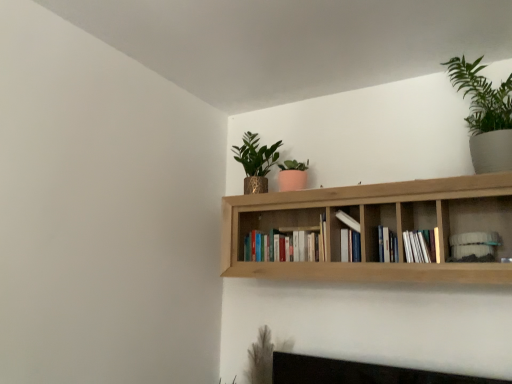
Question: Based on their positions, is natural wood bookshelf at upper center located to the left or right of hardcover books at center, which appears as the fifth book when viewed from the right?

Choices:
 (A) left
 (B) right

Answer: (B)

Question: From a real-world perspective, is natural wood bookshelf at upper center above or below hardcover books at center, which appears as the fifth book when viewed from the right?

Choices:
 (A) below
 (B) above

Answer: (B)

Question: Which is nearer to the white paper book at center-right, arranged as the 4th book when viewed from the left?

Choices:
 (A) white paper book at center, the second book when ordered from left to right
 (B) white matte bookshelf at upper right, the 5th book in the left-to-right sequence
 (C) matte gold pot at upper center, placed as the second houseplant when sorted from right to left
 (D) natural wood bookshelf at upper center
 (E) green matte plant at upper right, which appears as the first houseplant when viewed from the front

Answer: (B)

Question: Which object is the closest to the matte gold pot at upper center, placed as the second houseplant when sorted from right to left?

Choices:
 (A) natural wood bookshelf at upper center
 (B) white paper book at center-right, the second book when ordered from right to left
 (C) white paper book at center, which appears as the third book when viewed from the left
 (D) white paper book at center, the second book when ordered from left to right
 (E) white matte bookshelf at upper right, the 1th book viewed from the right

Answer: (A)